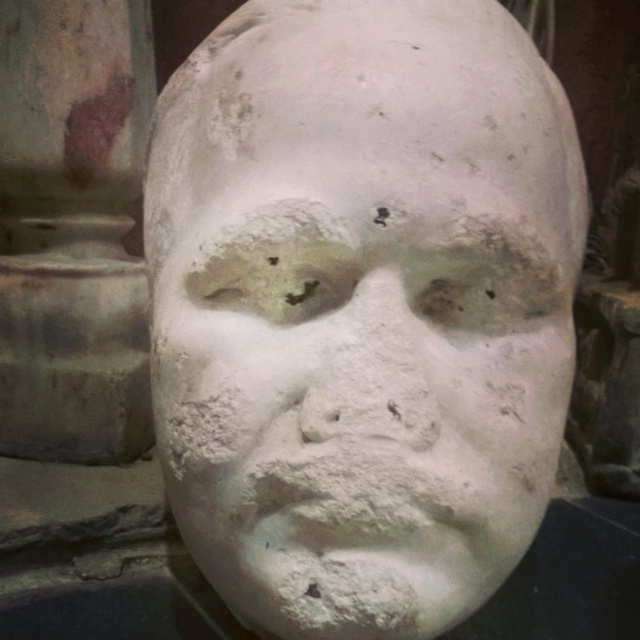
You are an art conservator examining a plaster sculpture. You notice two white elements at the center of the image. One is labeled as the white plaster mask at center, and the other is the white matte plaster at center. Based on their positions, which one is located below the other?

The white plaster mask at center is positioned under the white matte plaster at center, meaning the white plaster mask is below the white matte plaster.

You are an art restorer examining the image. You need to determine which object is larger between the white plaster mask at center and the white matte plaster at center. Based on the scene, which one is bigger?

The white plaster mask at center is bigger than the white matte plaster at center according to the description.

You are an art student examining a plaster cast of a human head. You notice a specific point at coordinates (362, 307). Based on the image description, can you determine which object this point belongs to?

The point at (362, 307) is on the white plaster mask at center.